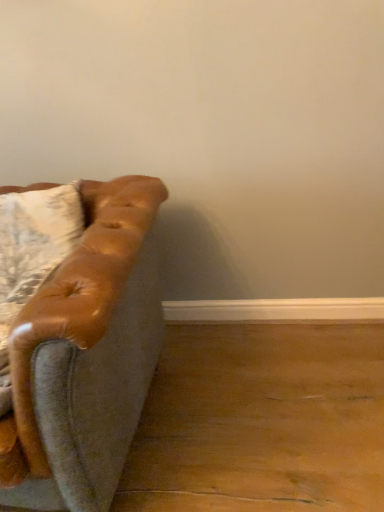
Question: Considering the positions of matte brown leather couch at left and leather pillow at left in the image, is matte brown leather couch at left bigger or smaller than leather pillow at left?

Choices:
 (A) small
 (B) big

Answer: (B)

Question: Is matte brown leather couch at left wider or thinner than leather pillow at left?

Choices:
 (A) wide
 (B) thin

Answer: (A)

Question: From a real-world perspective, relative to leather pillow at left, is matte brown leather couch at left vertically above or below?

Choices:
 (A) above
 (B) below

Answer: (B)

Question: Is leather pillow at left inside or outside of matte brown leather couch at left?

Choices:
 (A) outside
 (B) inside

Answer: (B)

Question: In terms of size, does leather pillow at left appear bigger or smaller than matte brown leather couch at left?

Choices:
 (A) big
 (B) small

Answer: (B)

Question: Would you say leather pillow at left is to the left or to the right of matte brown leather couch at left in the picture?

Choices:
 (A) left
 (B) right

Answer: (B)

Question: From the image's perspective, is leather pillow at left above or below matte brown leather couch at left?

Choices:
 (A) below
 (B) above

Answer: (B)